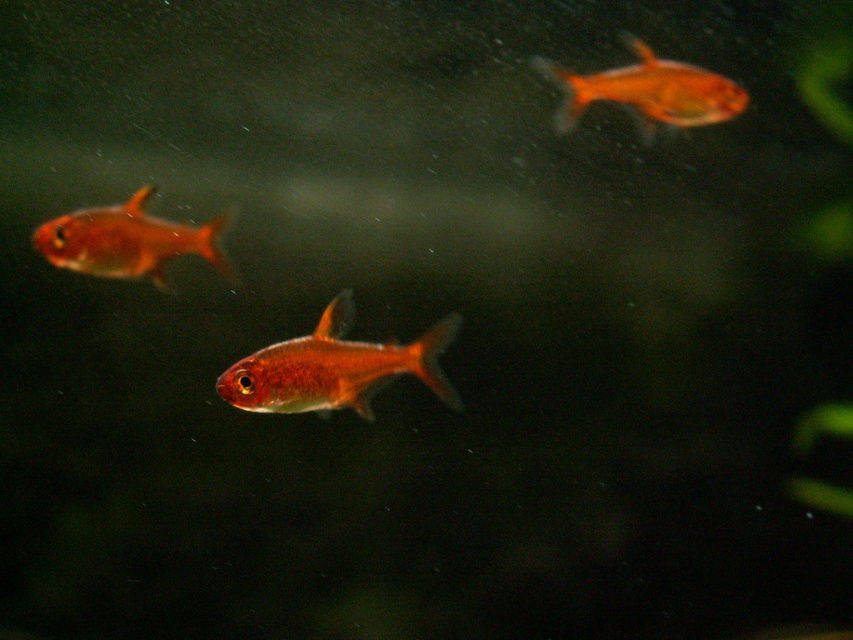
You are an underwater explorer observing the fish in the aquarium. You notice two points marked in the image. If you were to move forward from your current position, which point would you encounter first, point (390,346) or point (553,72)?

Point (390,346) is in front of point (553,72), so you would encounter point (390,346) first as you move forward.

Based on the photo, you are an aquatic robot with a body length of 10 inches. You need to navigate between the shiny orange fish at center and the shiny orange fish at left. Can you pass through the space between them without touching either fish?

The distance between the shiny orange fish at center and the shiny orange fish at left is 11.13 inches. Since your robot is 10 inches long, there is enough space to pass through without touching either fish.

From the picture: You are an underwater photographer aiming to capture a clear photo of the shiny orange fish at left and the glossy orange fish at upper right. Which fish will appear closer to the camera in the photo?

The shiny orange fish at left will appear closer to the camera in the photo because it is positioned in front of the glossy orange fish at upper right.